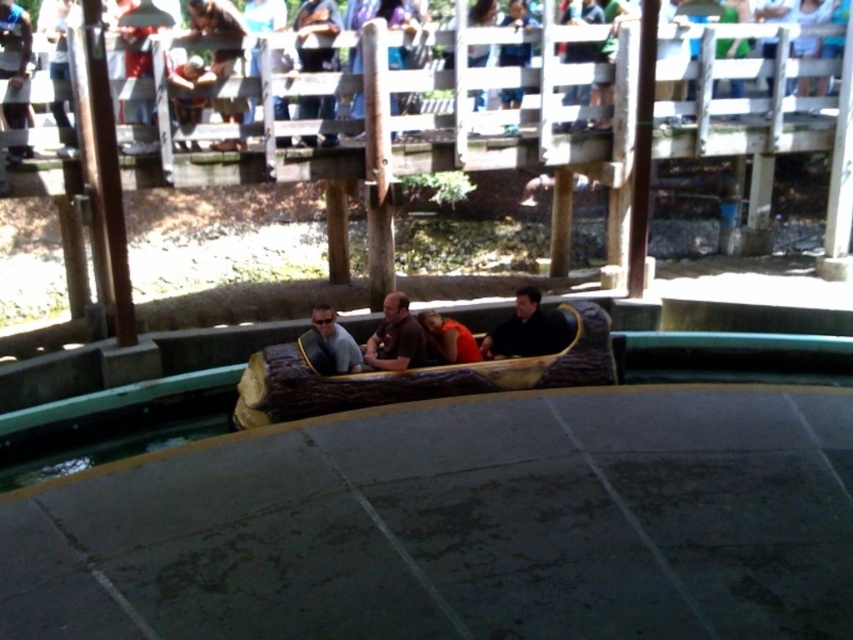
Can you confirm if black matte jacket at center is wider than brown leather jacket at center?

Yes, black matte jacket at center is wider than brown leather jacket at center.

Is point (525, 285) closer to viewer compared to point (418, 356)?

No, it is behind (418, 356).

Does point (549, 337) come closer to viewer compared to point (393, 344)?

No, (549, 337) is further to viewer.

At what (x,y) coordinates should I click in order to perform the action: click on black matte jacket at center. Please return your answer as a coordinate pair (x, y). This screenshot has width=853, height=640. Looking at the image, I should click on (525, 330).

How much distance is there between orange fabric at center and matte gray shirt at center?

30.09 inches

Between orange fabric at center and matte gray shirt at center, which one has less height?

orange fabric at center

Describe the element at coordinates (448, 337) in the screenshot. I see `orange fabric at center` at that location.

What are the coordinates of `orange fabric at center` in the screenshot? It's located at point(448,337).

Is brown leather jacket at center further to the viewer compared to matte gray shirt at center?

Yes.

Is brown leather jacket at center shorter than matte gray shirt at center?

Incorrect, brown leather jacket at center's height does not fall short of matte gray shirt at center's.

Between point (403, 362) and point (351, 346), which one is positioned behind?

The point (403, 362) is more distant.

I want to click on brown leather jacket at center, so click(x=395, y=337).